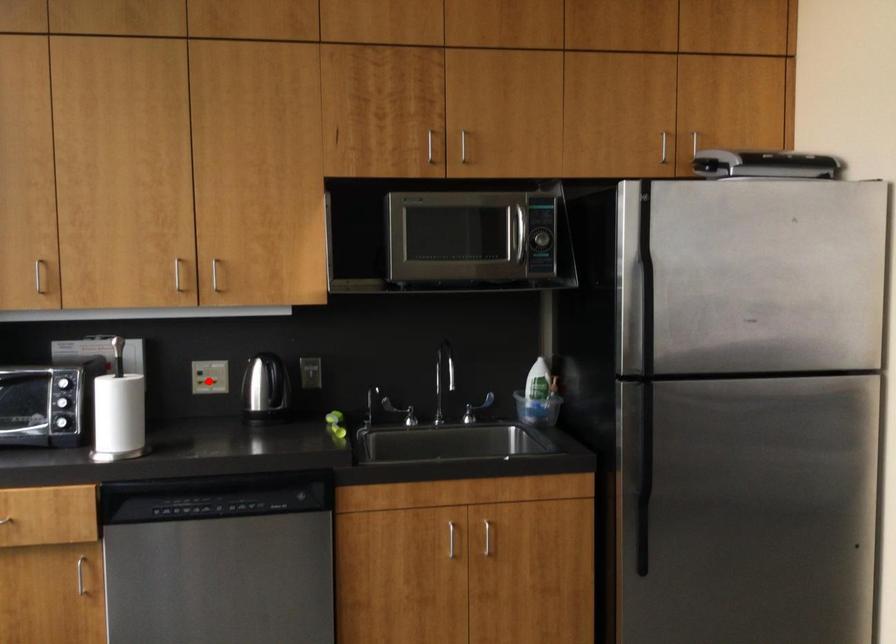
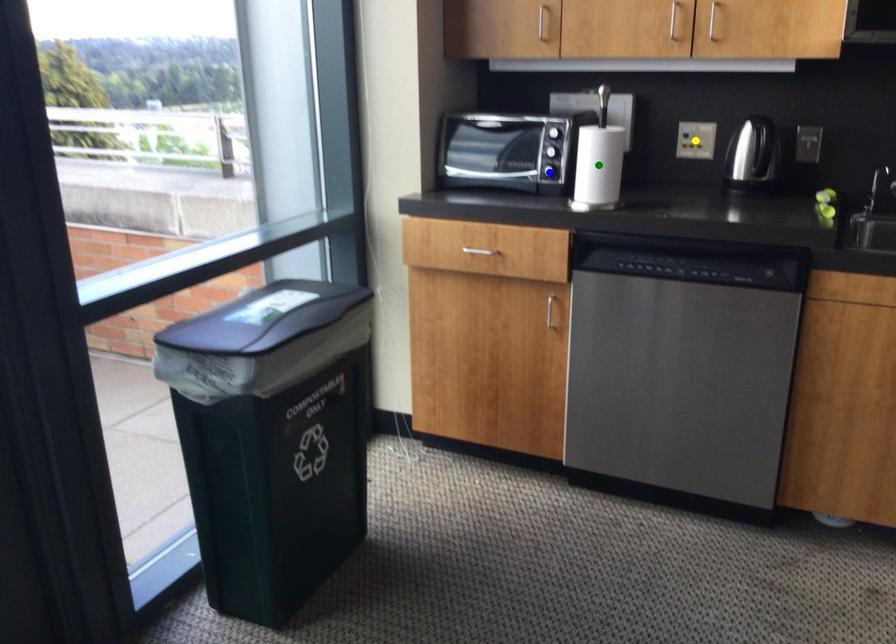
Question: I am providing you with two images of the same scene from different viewpoints. A red point is marked on the first image. You are given multiple points on the second image. Which point in image 2 is actually the same real-world point as the red point in image 1?

Choices:
 (A) blue point
 (B) green point
 (C) yellow point

Answer: (C)